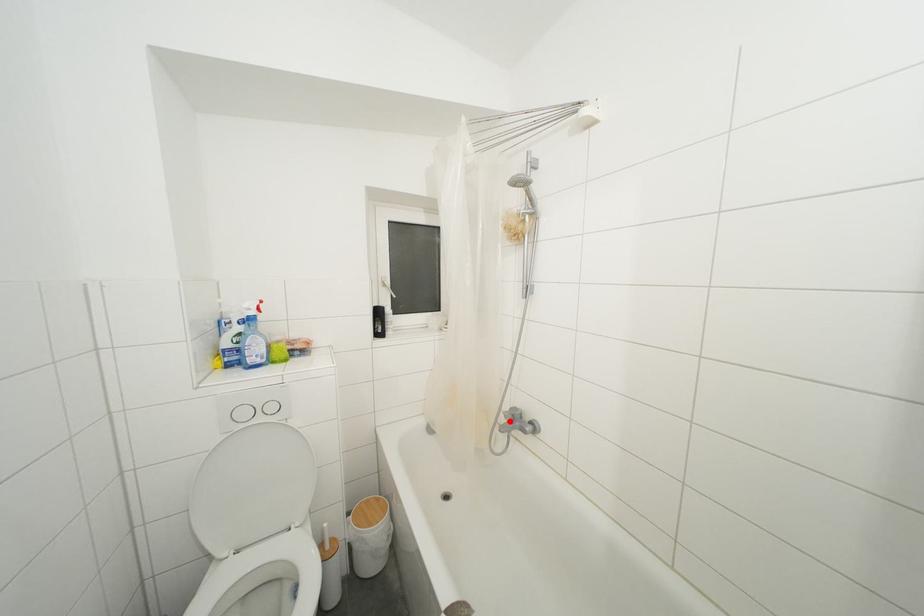
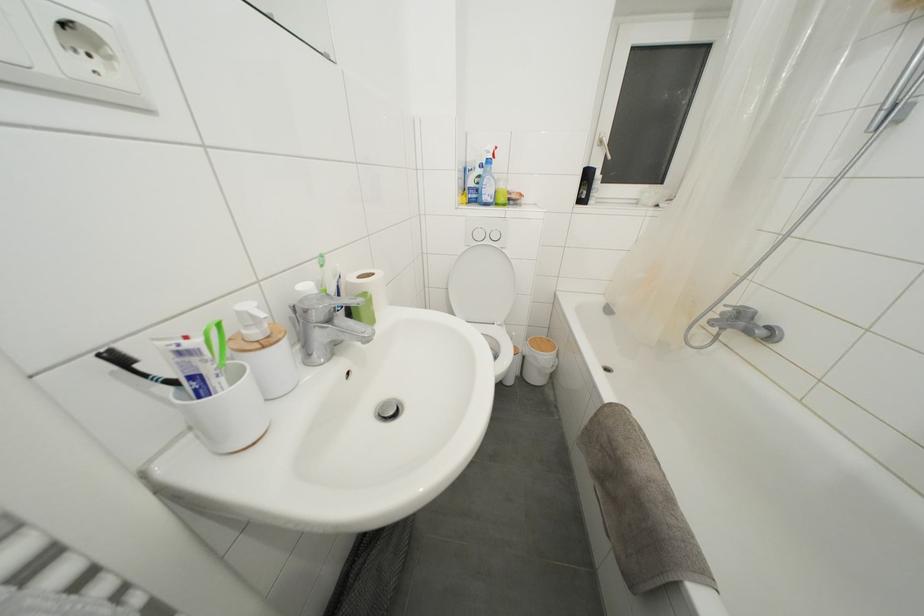
Question: I am providing you with two images of the same scene from different viewpoints. In image1, a red point is highlighted. Considering the same 3D point in image2, which of the following is correct?

Choices:
 (A) It is closer
 (B) It is farther

Answer: (A)